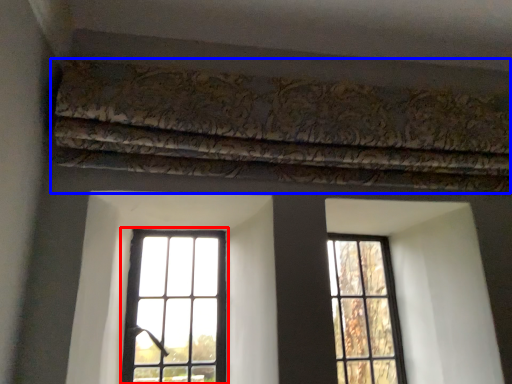
Question: Which of the following is the closest to the observer, window (highlighted by a red box) or curtain (highlighted by a blue box)?

Choices:
 (A) window
 (B) curtain

Answer: (B)